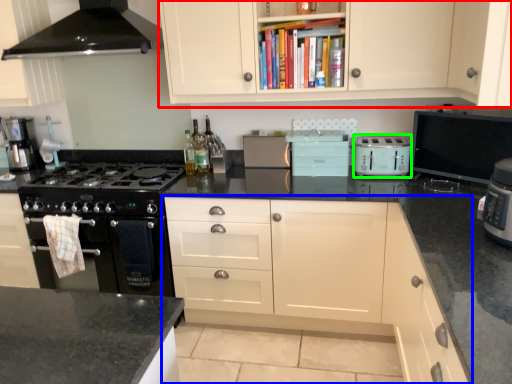
Question: Which is nearer to the cabinetry (highlighted by a red box)? cabinetry (highlighted by a blue box) or kitchen appliance (highlighted by a green box).

Choices:
 (A) cabinetry
 (B) kitchen appliance

Answer: (B)